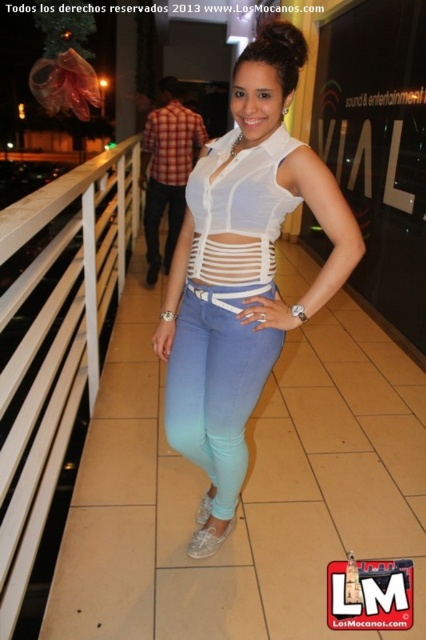
Which is more to the left, white matte top at center or light blue denim jeans at center?

From the viewer's perspective, light blue denim jeans at center appears more on the left side.

Is white matte top at center to the left of light blue denim jeans at center from the viewer's perspective?

Incorrect, white matte top at center is not on the left side of light blue denim jeans at center.

The height and width of the screenshot is (640, 426). What do you see at coordinates (241, 273) in the screenshot? I see `white matte top at center` at bounding box center [241, 273].

The image size is (426, 640). I want to click on white matte top at center, so click(x=241, y=273).

The image size is (426, 640). What do you see at coordinates (241, 273) in the screenshot?
I see `white matte top at center` at bounding box center [241, 273].

Does point (241, 476) come farther from viewer compared to point (46, 326)?

Yes.

Where is `white matte top at center`? white matte top at center is located at coordinates (241, 273).

Which is behind, point (238, 410) or point (146, 212)?

Positioned behind is point (146, 212).

Does light blue denim jeans at center have a larger size compared to white sheer top at center?

No.

Image resolution: width=426 pixels, height=640 pixels. Identify the location of light blue denim jeans at center. (216, 385).